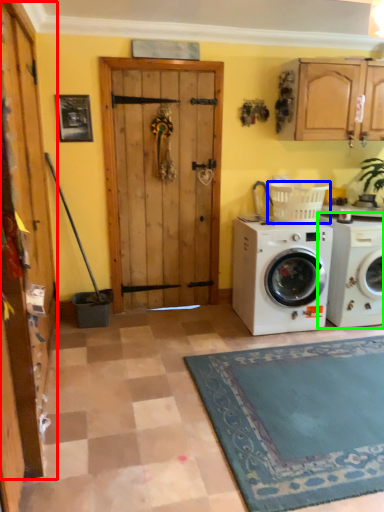
Question: Which object is positioned farthest from barn door (highlighted by a red box)? Select from laundry basket (highlighted by a blue box) and washing machine (highlighted by a green box).

Choices:
 (A) laundry basket
 (B) washing machine

Answer: (B)